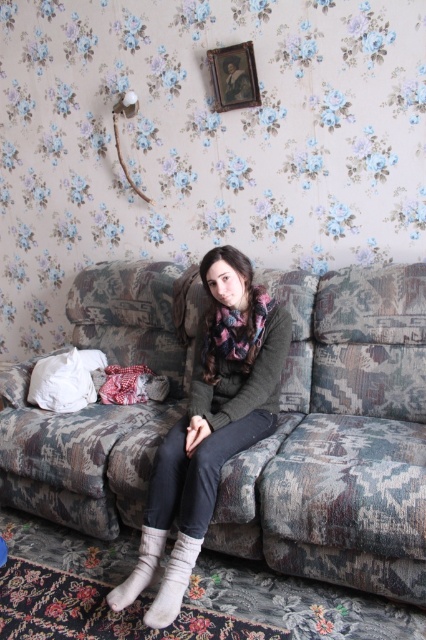
You are a delivery person trying to place a small package between the camouflage fabric couch at center and the white fuzzy socks at lower center. Can you fit the package there if it measures 50 centimeters in length?

The distance between the camouflage fabric couch at center and the white fuzzy socks at lower center is 55.31 centimeters. Since the package is 50 centimeters long, it can fit in the space between them.

You are trying to place a white soft sock at lower center on the camouflage fabric couch at center. Can you determine if the couch is wide enough to accommodate the sock?

The camouflage fabric couch at center might be wider than white soft sock at lower center, so there is a possibility that the couch can accommodate the sock.